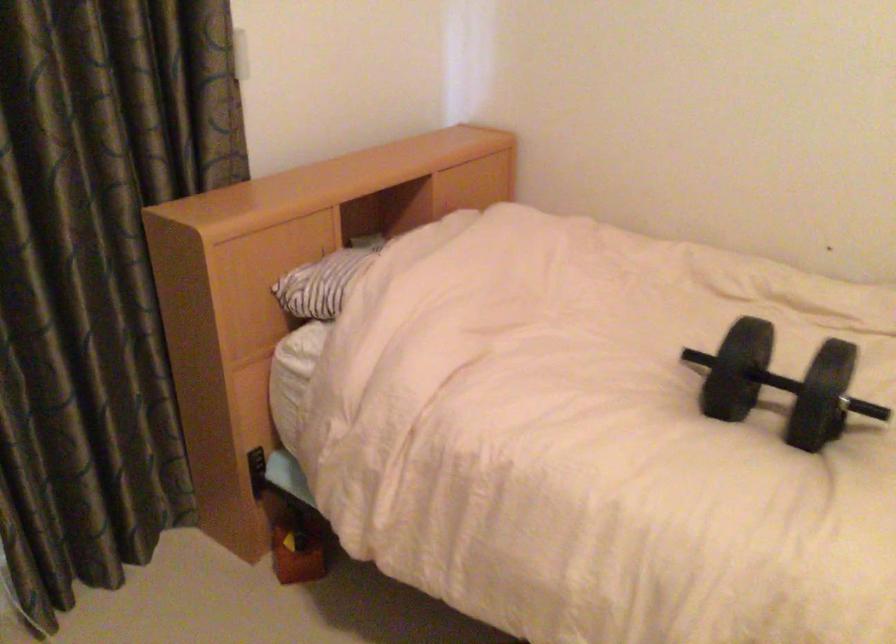
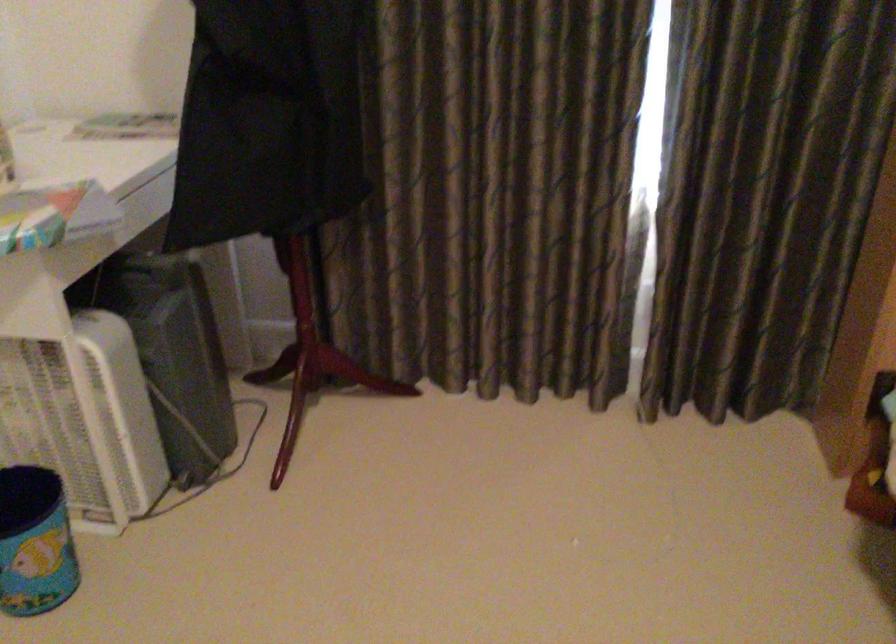
Where in the second image is the point corresponding to point (200, 402) from the first image?

(865, 298)